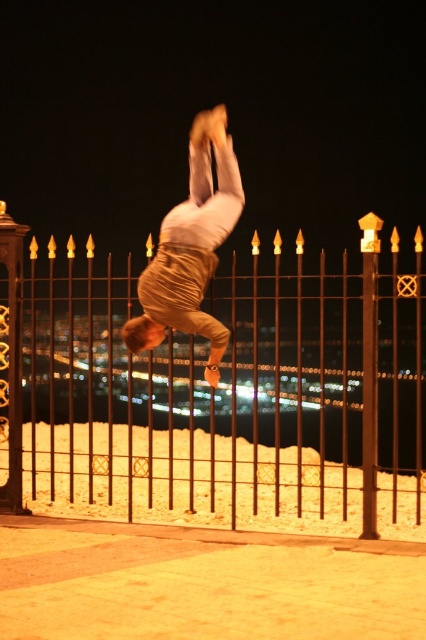
You are a photographer trying to capture the golden fabric pants at center and the black wrought iron fence at center in a single shot. Based on their positions, which object should appear closer to the camera in the photo?

The black wrought iron fence at center appears closer to the camera because the golden fabric pants at center is behind it.

You are a photographer trying to capture the perfect shot of the person doing a backflip over the black wrought iron fence at center. To ensure the fence is in the background, where should you position your camera relative to the person and the fence?

To have the black wrought iron fence at center in the background, position the camera so that the person is between you and the fence, ensuring the fence is behind the performer during the backflip.

You are a photographer trying to capture the golden fabric pants at center and the black wrought iron fence at center in a single frame. Based on their heights, which object will appear taller in the photo?

The golden fabric pants at center will appear taller in the photo because the black wrought iron fence at center is not as tall as golden fabric pants at center.